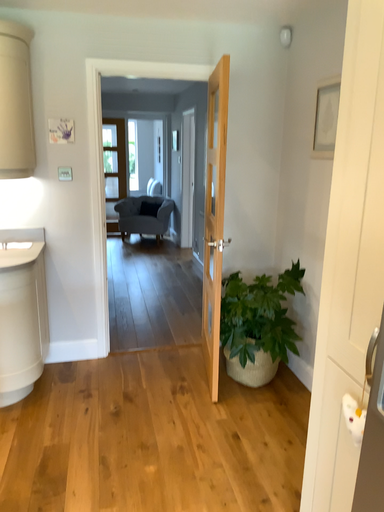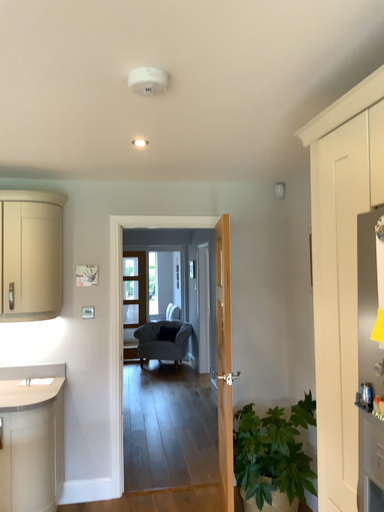
Question: Which way did the camera rotate in the video?

Choices:
 (A) rotated downward
 (B) rotated upward

Answer: (B)